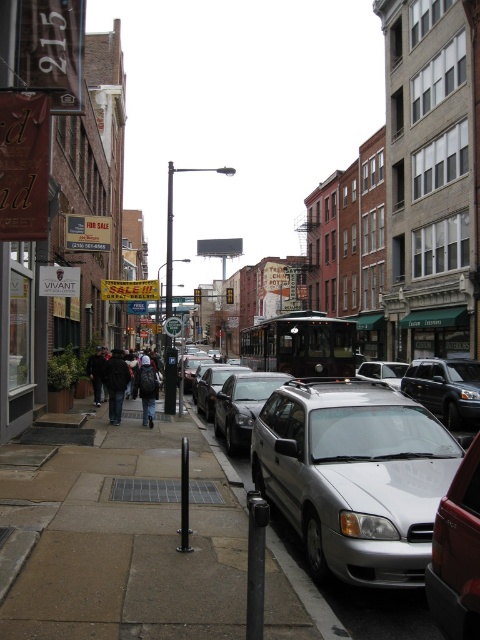
Question: Which object is positioned farthest from the dark gray jacket at center?

Choices:
 (A) silver metallic car at center
 (B) dark brown leather jacket at lower left

Answer: (A)

Question: Which object appears closest to the camera in this image?

Choices:
 (A) silver metallic car at center
 (B) shiny black suv at center
 (C) black jacket at center

Answer: (A)

Question: Does dark gray jacket at center have a greater width compared to dark blue jeans at center?

Choices:
 (A) yes
 (B) no

Answer: (A)

Question: Is gray concrete sidewalk at lower center above dark brown leather jacket at lower left?

Choices:
 (A) no
 (B) yes

Answer: (A)

Question: Can you confirm if gray concrete sidewalk at lower center is positioned to the left of dark brown leather jacket at lower left?

Choices:
 (A) no
 (B) yes

Answer: (A)

Question: Among these points, which one is nearest to the camera?

Choices:
 (A) (228, 435)
 (B) (405, 365)

Answer: (A)